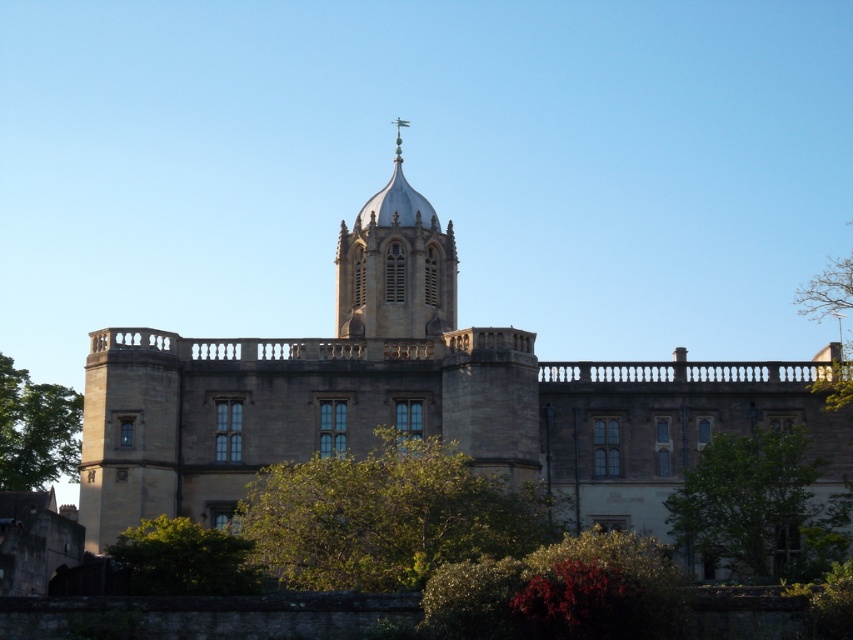
Which of these two, green leafy tree at center or green leafy tree at lower left, stands shorter?

green leafy tree at center is shorter.

Can you confirm if green leafy tree at center is positioned to the left of green leafy tree at lower left?

No, green leafy tree at center is not to the left of green leafy tree at lower left.

Does point (492, 556) lie behind point (20, 390)?

No.

Identify the location of green leafy tree at center. The height and width of the screenshot is (640, 853). (386, 516).

How far apart are brown stone church at center and green leafy tree at lower left?

brown stone church at center and green leafy tree at lower left are 21.49 meters apart from each other.

Does brown stone church at center have a greater height compared to green leafy tree at lower left?

Yes.

Is point (119, 419) positioned after point (10, 451)?

No, it is not.

Find the location of `brown stone church at center`. brown stone church at center is located at coordinates (416, 396).

Which is above, green leafy tree at lower left or green leafy tree at upper right?

green leafy tree at upper right is higher up.

Can you confirm if green leafy tree at lower left is shorter than green leafy tree at upper right?

Yes, green leafy tree at lower left is shorter than green leafy tree at upper right.

Find the location of a particular element. green leafy tree at lower left is located at coordinates (36, 429).

Identify the location of green leafy tree at lower left. (36, 429).